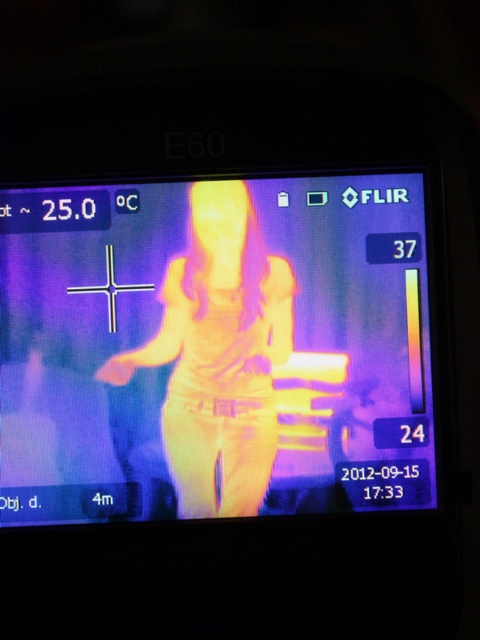
Question: Is yellow metallic phone at center to the right of yellow-orange fabric at center from the viewer's perspective?

Choices:
 (A) yes
 (B) no

Answer: (A)

Question: Can you confirm if yellow metallic phone at center is positioned to the left of yellow-orange fabric at center?

Choices:
 (A) no
 (B) yes

Answer: (A)

Question: Is yellow metallic phone at center positioned behind yellow-orange fabric at center?

Choices:
 (A) no
 (B) yes

Answer: (A)

Question: Which object is farther from the camera taking this photo?

Choices:
 (A) yellow-orange fabric at center
 (B) yellow metallic phone at center

Answer: (A)

Question: Which point appears farthest from the camera in this image?

Choices:
 (A) (397, 289)
 (B) (208, 426)

Answer: (A)